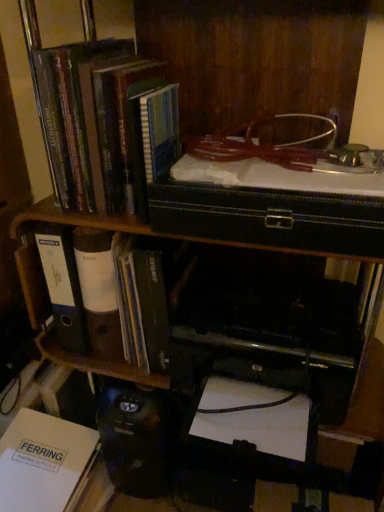
Question: From the image's perspective, would you say white paper folder at left, positioned as the 2th book in bottom-to-top order, is positioned over white paper at lower left, positioned as the 3th book in top-to-bottom order?

Choices:
 (A) no
 (B) yes

Answer: (B)

Question: Is white paper folder at left, the 2th book in the top-to-bottom sequence, thinner than white paper at lower left, positioned as the 3th book in top-to-bottom order?

Choices:
 (A) no
 (B) yes

Answer: (A)

Question: Is white paper folder at left, positioned as the 2th book in bottom-to-top order, wider than white paper at lower left, placed as the 1th book when sorted from bottom to top?

Choices:
 (A) no
 (B) yes

Answer: (B)

Question: Does white paper folder at left, the 2th book in the top-to-bottom sequence, have a smaller size compared to white paper at lower left, placed as the 1th book when sorted from bottom to top?

Choices:
 (A) yes
 (B) no

Answer: (A)

Question: Looking at their shapes, would you say hardcover book at upper left, the third book ordered from the bottom, is wider or thinner than black plastic printer at lower center?

Choices:
 (A) wide
 (B) thin

Answer: (B)

Question: Based on their sizes in the image, would you say hardcover book at upper left, the third book ordered from the bottom, is bigger or smaller than black plastic printer at lower center?

Choices:
 (A) big
 (B) small

Answer: (B)

Question: From a real-world perspective, is hardcover book at upper left, which is the first book from top to bottom, physically located above or below black plastic printer at lower center?

Choices:
 (A) above
 (B) below

Answer: (A)

Question: Relative to black plastic printer at lower center, is hardcover book at upper left, which is the first book from top to bottom, in front or behind?

Choices:
 (A) front
 (B) behind

Answer: (A)

Question: In terms of size, does white paper folder at left, the 2th book in the top-to-bottom sequence, appear bigger or smaller than hardcover book at upper left, which is the first book from top to bottom?

Choices:
 (A) small
 (B) big

Answer: (A)

Question: In terms of height, does white paper folder at left, positioned as the 2th book in bottom-to-top order, look taller or shorter compared to hardcover book at upper left, the third book ordered from the bottom?

Choices:
 (A) tall
 (B) short

Answer: (B)

Question: Visually, is white paper folder at left, the 2th book in the top-to-bottom sequence, positioned to the left or to the right of hardcover book at upper left, the third book ordered from the bottom?

Choices:
 (A) right
 (B) left

Answer: (B)

Question: Choose the correct answer: Is white paper folder at left, the 2th book in the top-to-bottom sequence, inside hardcover book at upper left, the third book ordered from the bottom, or outside it?

Choices:
 (A) inside
 (B) outside

Answer: (B)

Question: From a real-world perspective, is white paper at lower left, positioned as the 3th book in top-to-bottom order, above or below white paper folder at left, the 2th book in the top-to-bottom sequence?

Choices:
 (A) below
 (B) above

Answer: (A)

Question: Relative to white paper folder at left, positioned as the 2th book in bottom-to-top order, is white paper at lower left, positioned as the 3th book in top-to-bottom order, in front or behind?

Choices:
 (A) front
 (B) behind

Answer: (B)